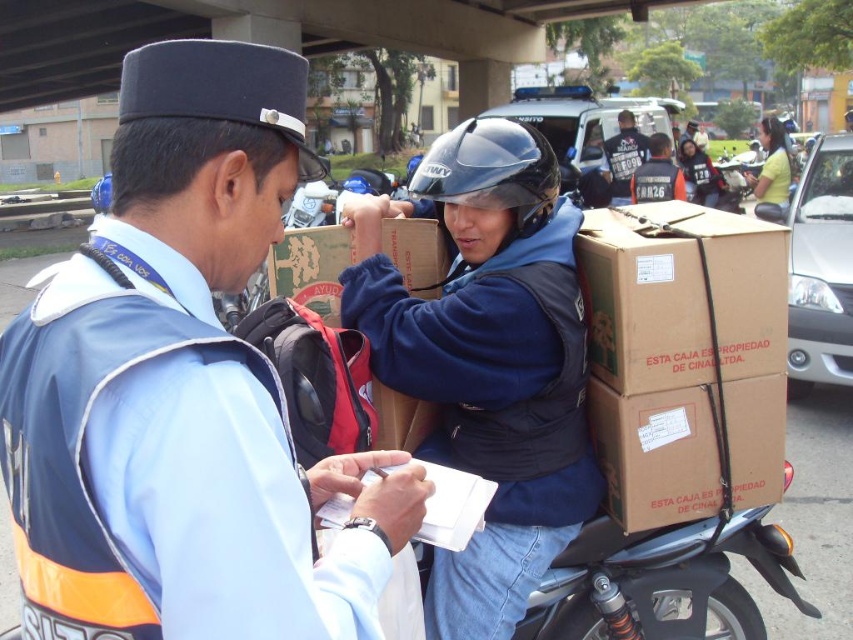
Can you confirm if black matte helmet at center is shorter than yellow matte shirt at upper right?

Yes.

Locate an element on the screen. Image resolution: width=853 pixels, height=640 pixels. black matte helmet at center is located at coordinates (x=491, y=172).

Is point (525, 160) behind point (769, 188)?

No, (525, 160) is in front of (769, 188).

Find the location of a particular element. The width and height of the screenshot is (853, 640). black matte helmet at center is located at coordinates (491, 172).

Does blue uniform at center appear over brown cardboard box at center?

No.

Does blue uniform at center appear on the right side of brown cardboard box at center?

No, blue uniform at center is not to the right of brown cardboard box at center.

Locate an element on the screen. blue uniform at center is located at coordinates (183, 388).

Where is `blue uniform at center`? This screenshot has height=640, width=853. blue uniform at center is located at coordinates (183, 388).

You are a GUI agent. You are given a task and a screenshot of the screen. Output one action in this format:
    pyautogui.click(x=<x>, y=<y>)
    Task: Click on the blue uniform at center
    The height and width of the screenshot is (640, 853).
    Given the screenshot: What is the action you would take?
    pyautogui.click(x=183, y=388)

Is point (135, 77) closer to viewer compared to point (459, 177)?

Yes, point (135, 77) is in front of point (459, 177).

Locate an element on the screen. The width and height of the screenshot is (853, 640). blue uniform at center is located at coordinates (183, 388).